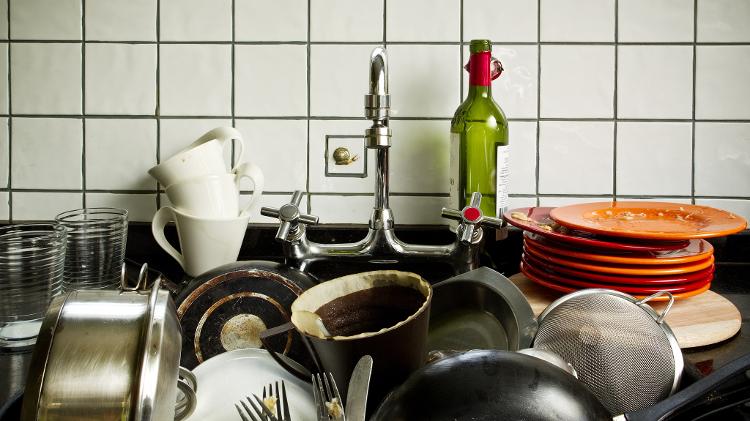
Find the location of a particular element. This screenshot has height=421, width=750. handle is located at coordinates (160, 226), (260, 185), (234, 135), (669, 301), (273, 328), (136, 275).